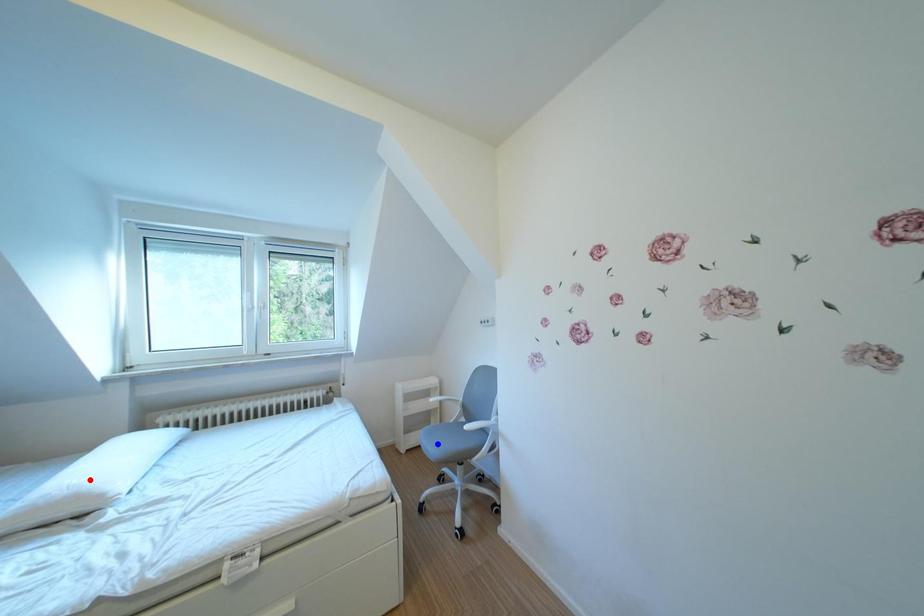
Question: Which of the two points in the image is closer to the camera?

Choices:
 (A) Blue point is closer.
 (B) Red point is closer.

Answer: (B)